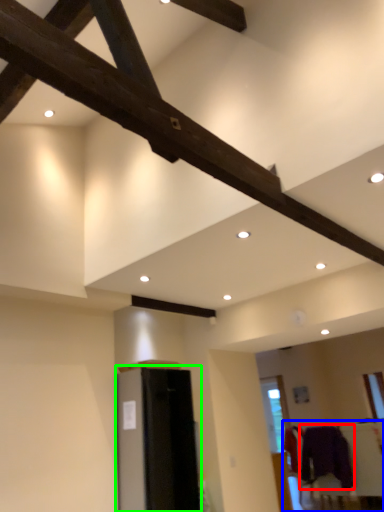
Question: Considering the real-world distances, which object is farthest from clothing (highlighted by a red box)? furniture (highlighted by a blue box) or furniture (highlighted by a green box)?

Choices:
 (A) furniture
 (B) furniture

Answer: (B)